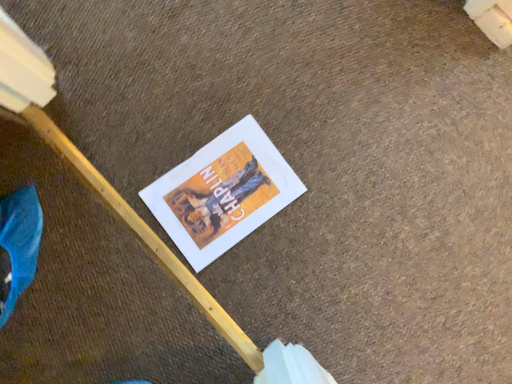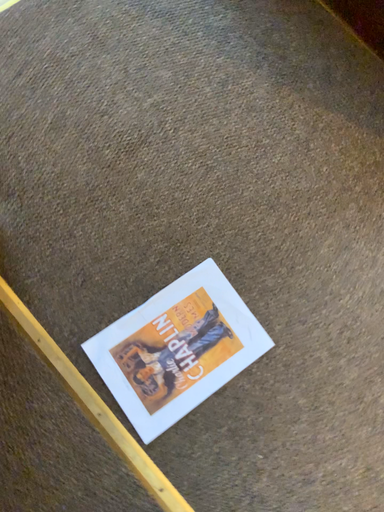
Question: How did the camera likely rotate when shooting the video?

Choices:
 (A) rotated downward
 (B) rotated upward

Answer: (B)